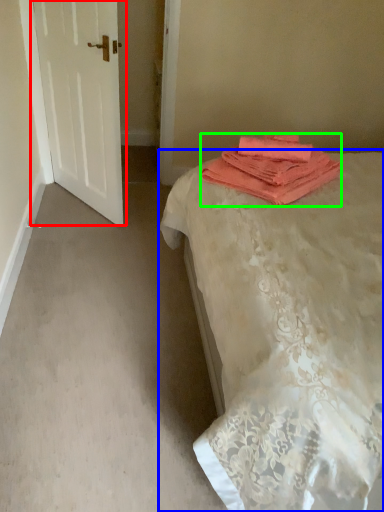
Question: Which object is positioned closest to door (highlighted by a red box)? Select from bed (highlighted by a blue box) and towel (highlighted by a green box).

Choices:
 (A) bed
 (B) towel

Answer: (B)